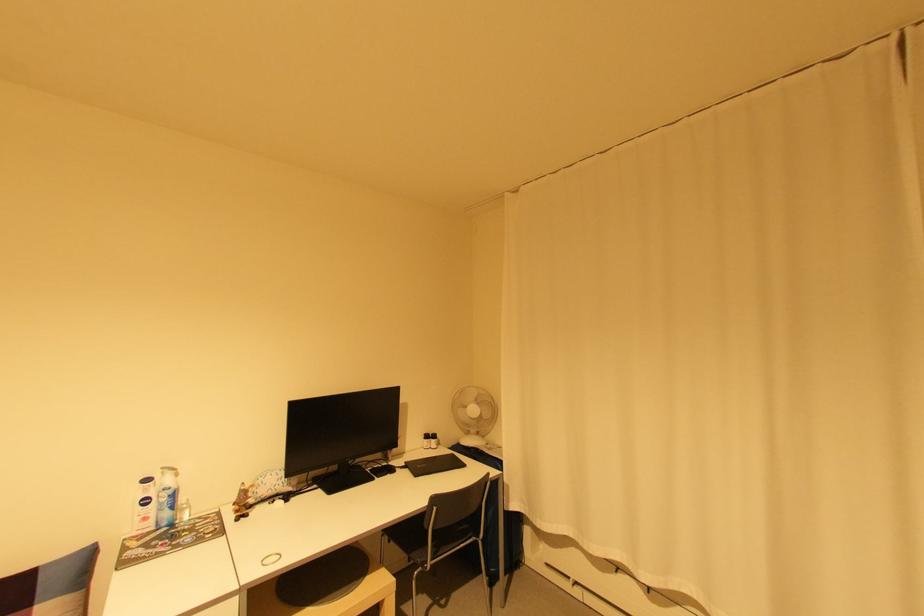
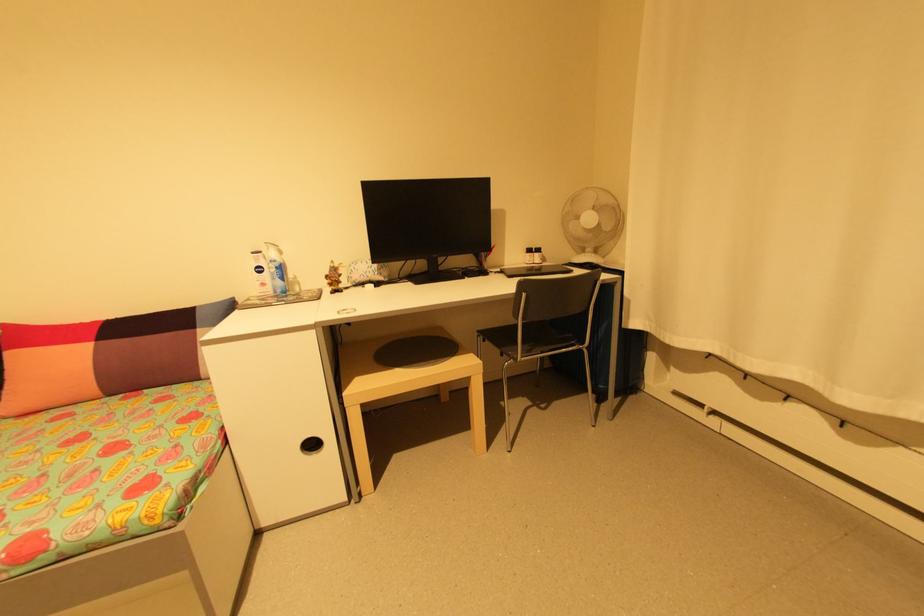
Find the pixel in the second image that matches pixel 251 488 in the first image.

(341, 265)